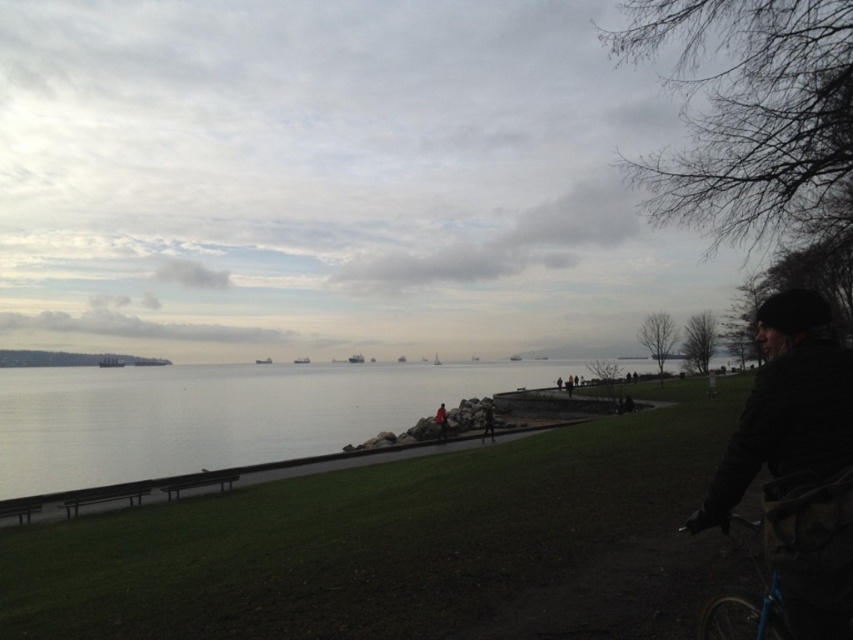
Question: Is dark woolen hat at right below blue metallic bicycle at lower right?

Choices:
 (A) no
 (B) yes

Answer: (A)

Question: Can you confirm if dark woolen hat at right is smaller than blue metallic bicycle at lower right?

Choices:
 (A) yes
 (B) no

Answer: (B)

Question: Can you confirm if dark woolen hat at right is positioned to the right of blue metallic bicycle at lower right?

Choices:
 (A) no
 (B) yes

Answer: (B)

Question: Which point is closer to the camera?

Choices:
 (A) blue metallic bicycle at lower right
 (B) dark woolen hat at right

Answer: (B)